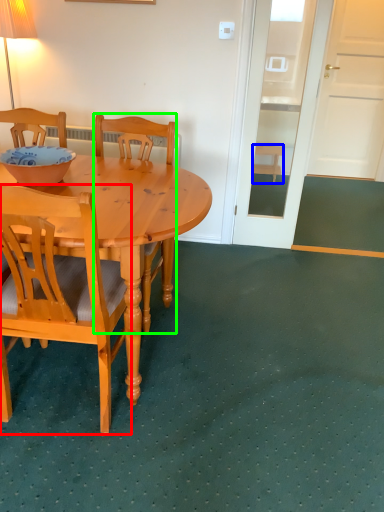
Question: Considering the real-world distances, which object is closest to chair (highlighted by a red box)? stool (highlighted by a blue box) or chair (highlighted by a green box).

Choices:
 (A) stool
 (B) chair

Answer: (B)